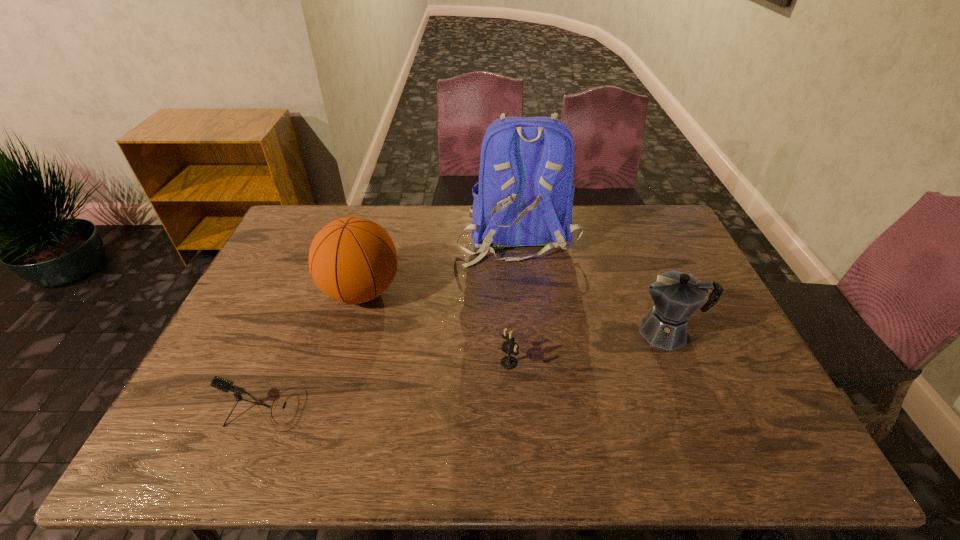
At what (x,y) coordinates should I click in order to perform the action: click on backpack. Please return your answer as a coordinate pair (x, y). The height and width of the screenshot is (540, 960). Looking at the image, I should click on (524, 197).

Locate an element on the screen. This screenshot has width=960, height=540. the second tallest object is located at coordinates (353, 260).

Where is `the third tallest object`? Image resolution: width=960 pixels, height=540 pixels. the third tallest object is located at coordinates (676, 295).

Identify the location of the rightmost object. (676, 295).

Image resolution: width=960 pixels, height=540 pixels. Identify the location of the second nearest object. (509, 347).

The image size is (960, 540). What are the coordinates of `microphone` in the screenshot? It's located at (225, 385).

The height and width of the screenshot is (540, 960). In order to click on free space located 0.140m on the back of the tallest object in this screenshot , I will do `click(523, 300)`.

Find the location of a particular element. The image size is (960, 540). vacant space located on the back of the basketball is located at coordinates (377, 237).

At what (x,y) coordinates should I click in order to perform the action: click on vacant space located 0.090m at the spout of the coffeepot. Please return your answer as a coordinate pair (x, y). Looking at the image, I should click on (600, 332).

This screenshot has height=540, width=960. I want to click on free space located 0.320m at the spout of the coffeepot, so click(516, 332).